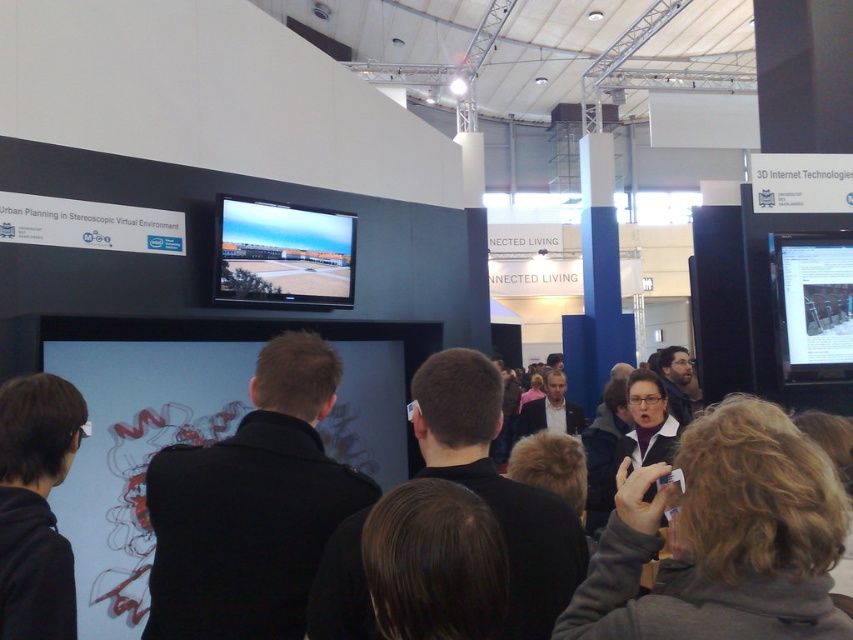
Question: Does black matte jacket at lower left have a smaller size compared to matte black screen at upper right?

Choices:
 (A) no
 (B) yes

Answer: (A)

Question: Which point is closer to the camera?

Choices:
 (A) (227, 250)
 (B) (7, 595)

Answer: (B)

Question: Which point is farther to the camera?

Choices:
 (A) black matte jacket at center
 (B) matte black screen at upper right
 (C) matte black screen at upper center
 (D) black matte jacket at lower left

Answer: (B)

Question: Does matte black screen at upper center appear on the left side of matte black screen at upper right?

Choices:
 (A) yes
 (B) no

Answer: (A)

Question: Based on their relative distances, which object is farther from the matte black screen at upper center?

Choices:
 (A) black matte jacket at center
 (B) matte black screen at upper right

Answer: (A)

Question: Does black matte jacket at lower left come behind matte black screen at upper center?

Choices:
 (A) no
 (B) yes

Answer: (A)